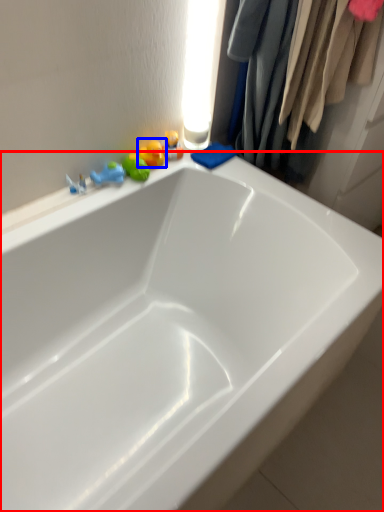
Question: Among these objects, which one is nearest to the camera, bathtub (highlighted by a red box) or toy (highlighted by a blue box)?

Choices:
 (A) bathtub
 (B) toy

Answer: (A)